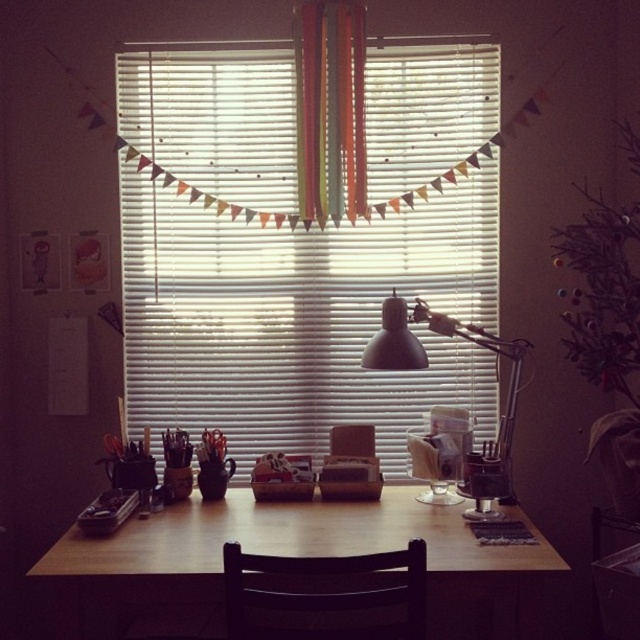
Does white blinds at center lie behind multicolored fabric strips at center?

Yes, it is.

Who is more forward, (180, 396) or (337, 56)?

Point (337, 56) is more forward.

I want to click on white blinds at center, so click(x=300, y=317).

Is point (232, 556) closer to camera compared to point (317, 97)?

Yes, point (232, 556) is closer to viewer.

Is point (353, 636) positioned in front of point (326, 182)?

That is True.

The width and height of the screenshot is (640, 640). What are the coordinates of `dark wood chair at center` in the screenshot? It's located at (324, 595).

Does white blinds at center have a smaller size compared to wooden table at center?

Correct, white blinds at center occupies less space than wooden table at center.

Which is above, white blinds at center or wooden table at center?

Positioned higher is white blinds at center.

Identify the location of white blinds at center. This screenshot has width=640, height=640. (300, 317).